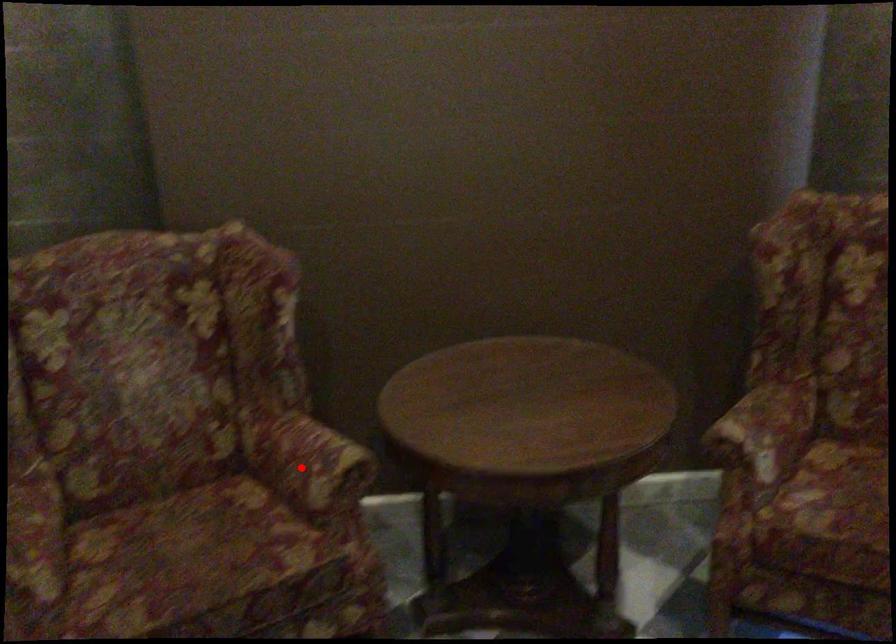
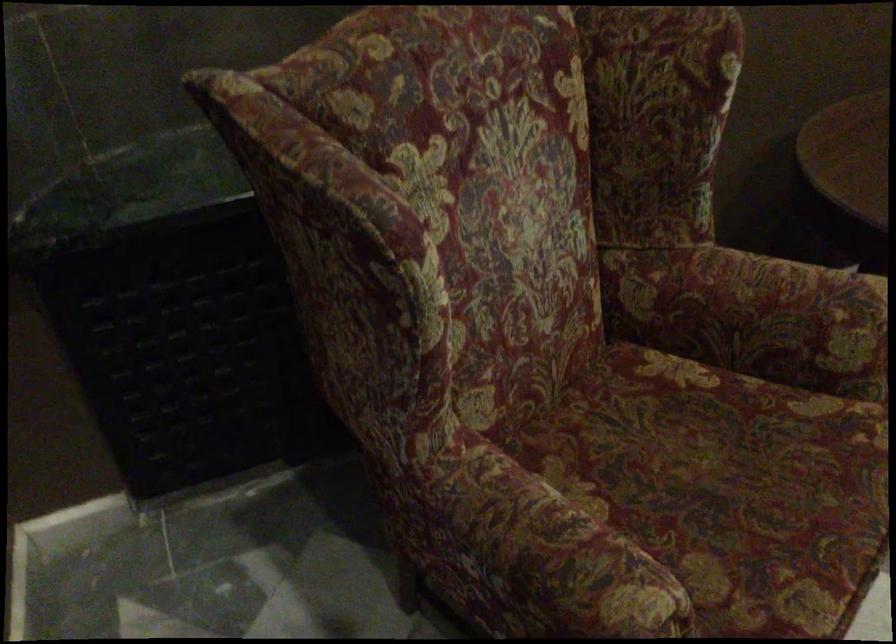
Question: I am providing you with two images of the same scene from different viewpoints. Image1 has a red point marked. In image2, the corresponding 3D location appears at what relative position? Reply with the corresponding letter.

Choices:
 (A) Closer
 (B) Farther

Answer: (A)